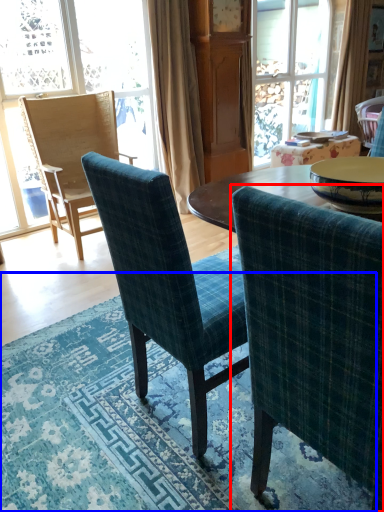
Question: Which point is closer to the camera, chair (highlighted by a red box) or mat (highlighted by a blue box)?

Choices:
 (A) chair
 (B) mat

Answer: (A)